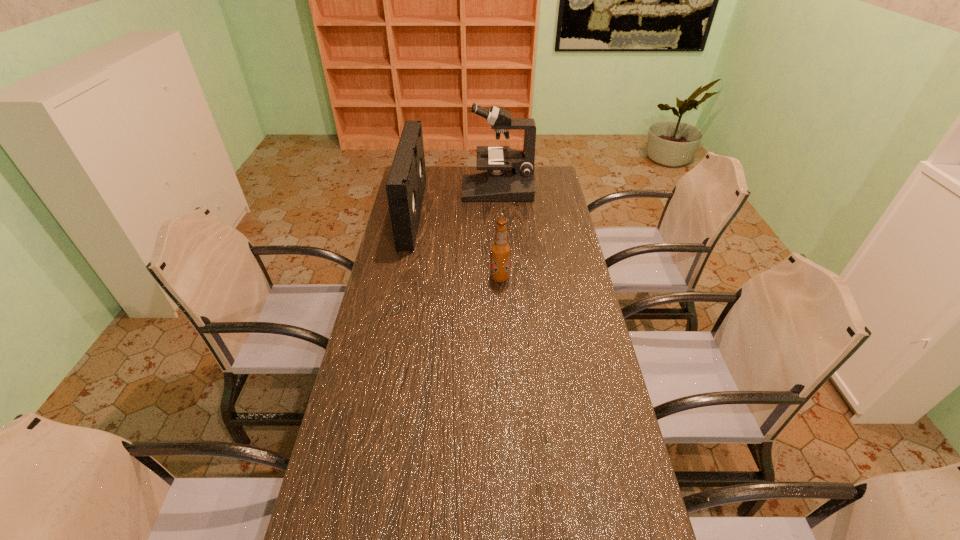
The height and width of the screenshot is (540, 960). What are the coordinates of `vacant space located on the front label of the second nearest object` in the screenshot? It's located at (463, 278).

Locate an element on the screen. free space located on the front label of the second nearest object is located at coordinates (407, 278).

Image resolution: width=960 pixels, height=540 pixels. Identify the location of microscope situated at the far edge. (510, 173).

I want to click on videotape present at the far edge, so click(x=406, y=183).

The image size is (960, 540). What are the coordinates of `object at the left edge` in the screenshot? It's located at (406, 183).

Locate an element on the screen. The height and width of the screenshot is (540, 960). object that is at the right edge is located at coordinates (510, 173).

At what (x,y) coordinates should I click in order to perform the action: click on object that is positioned at the far left corner. Please return your answer as a coordinate pair (x, y). The width and height of the screenshot is (960, 540). Looking at the image, I should click on (406, 183).

Identify the location of object that is positioned at the far right corner. This screenshot has height=540, width=960. (510, 173).

Where is `vacant space at the left edge of the desktop`? This screenshot has height=540, width=960. vacant space at the left edge of the desktop is located at coordinates (432, 199).

In the image, there is a desktop. Where is `free space at the right edge`? Image resolution: width=960 pixels, height=540 pixels. free space at the right edge is located at coordinates (540, 217).